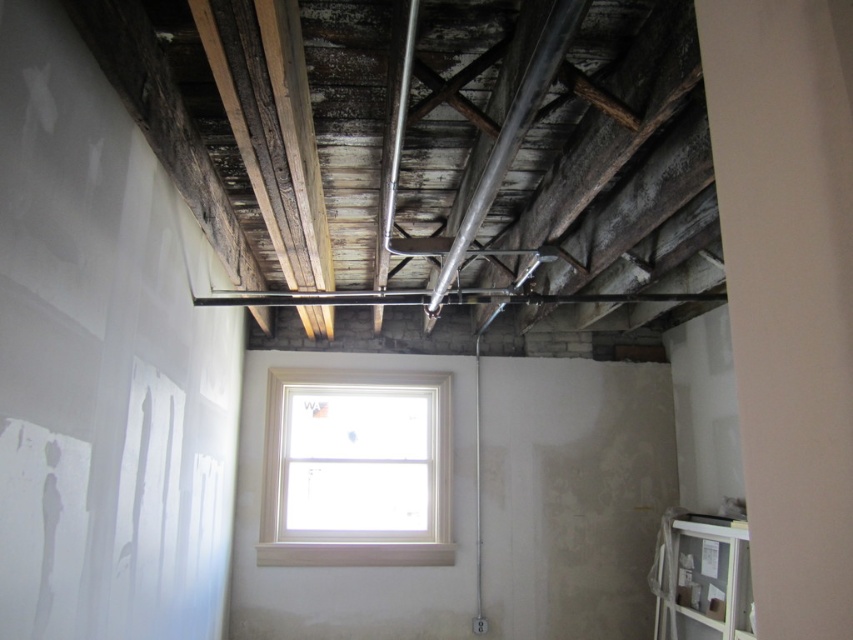
You are a construction worker looking at the image. You need to install a new fixture between the white painted wood window at center and the matte silver pipe at center. Based on their positions, which object should you place the fixture closer to in order to center it between them?

The white painted wood window at center is to the left of the matte silver pipe at center, so to center the fixture between them, it should be placed closer to the white painted wood window at center.

You are standing in the construction area and want to reach the point that is closer to you. Which point should you head towards, point at (292, 394) or point at (524, 93)?

You should head towards point at (524, 93) because it is closer to you than point at (292, 394).

You are standing in the center of the room and want to look out through the white painted wood window at center. In which direction should you turn your head to face the window?

Since the white painted wood window at center is located at point 0.733 on the x and 0.419 on the y coordinate, you should turn your head slightly to the right and upwards to face the window.